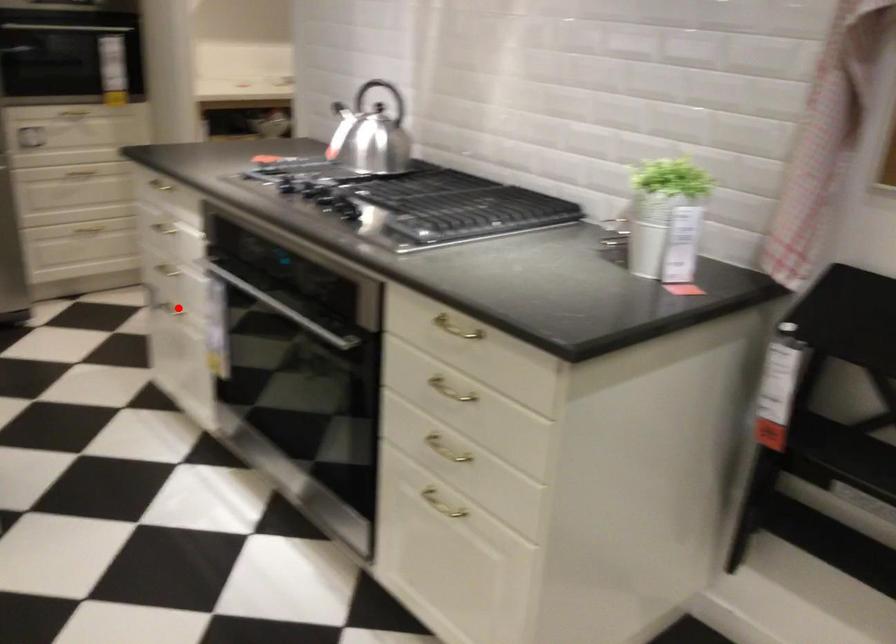
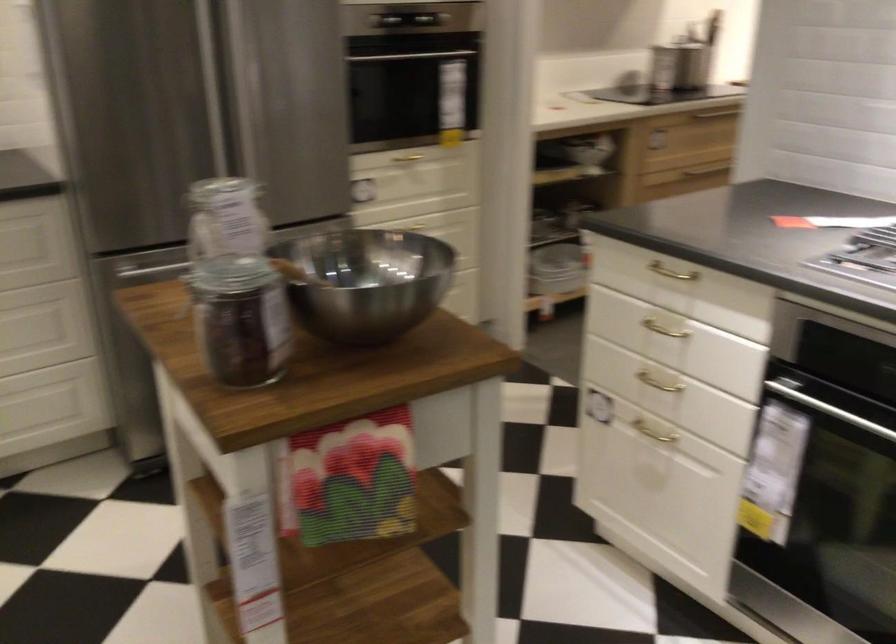
Question: A red point is marked in image1. In image2, is the corresponding 3D point closer to the camera or farther? Reply with the corresponding letter.

Choices:
 (A) The corresponding 3D point is closer.
 (B) The corresponding 3D point is farther.

Answer: (A)